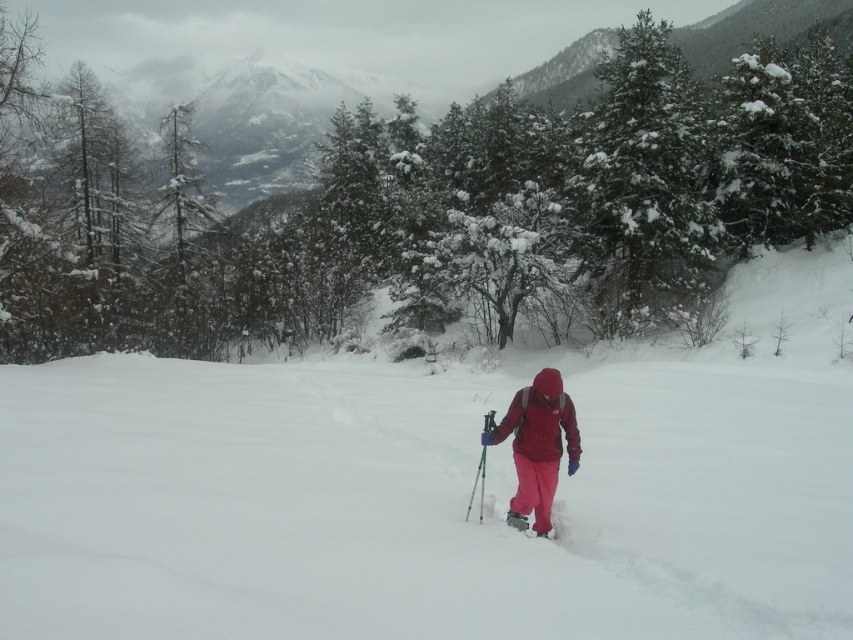
You are standing at the point marked as point (x=642, y=184) in the image. What object is located at that point?

The point (x=642, y=184) marks the snow covered evergreen at upper right.